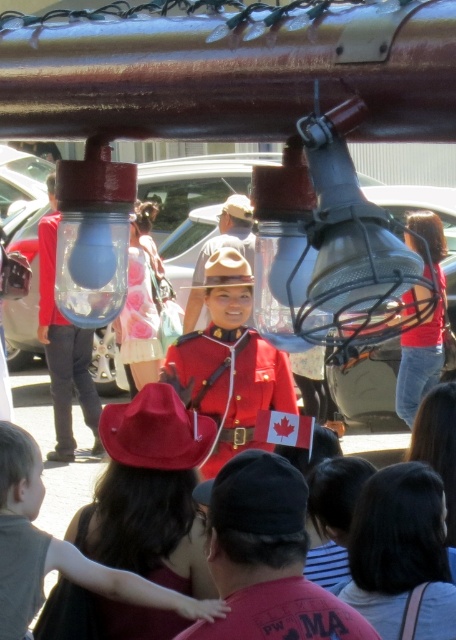
You are a photographer at the event and want to capture both the matte red cowboy hat at lower left and the red felt cowboy hat at center in a single shot. Which hat will appear taller in the photo?

The matte red cowboy hat at lower left will appear taller in the photo since it has a greater height compared to the red felt cowboy hat at center.

You are a photographer standing in the crowd at the event. You want to take a photo that includes both the red uniform at center and the red felt cowboy hat at center. Which object should you focus on first to ensure both are in frame?

You should focus on the red uniform at center first since it is closer to you than the red felt cowboy hat at center, ensuring both are in the frame by adjusting your camera angle accordingly.

You are a photographer standing at the center of the scene. You want to take a photo of the matte red cowboy hat at lower left and the red felt cowboy hat at center. Can you fit both hats in your camera frame if your camera has a 30 inch field of view?

The distance between the matte red cowboy hat at lower left and the red felt cowboy hat at center is 32.13 inches, which is slightly wider than the camera frame of 30 inches. Therefore, both hats cannot be fully captured in a single frame.